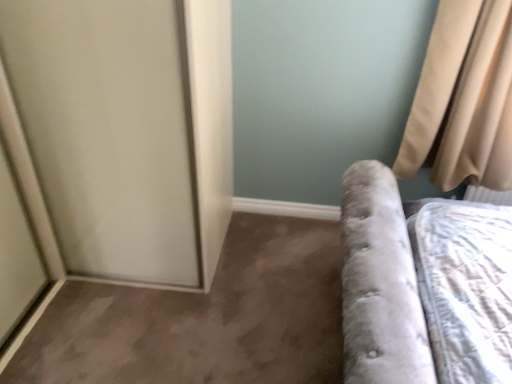
What do you see at coordinates (106, 132) in the screenshot? Image resolution: width=512 pixels, height=384 pixels. I see `white frosted glass screen door at left` at bounding box center [106, 132].

Locate an element on the screen. This screenshot has height=384, width=512. white frosted glass screen door at left is located at coordinates (106, 132).

Measure the distance between white frosted glass screen door at left and camera.

white frosted glass screen door at left is 1.27 meters from camera.

Where is `beige fabric curtain at upper right`? The image size is (512, 384). beige fabric curtain at upper right is located at coordinates (464, 98).

What do you see at coordinates (464, 98) in the screenshot? The width and height of the screenshot is (512, 384). I see `beige fabric curtain at upper right` at bounding box center [464, 98].

Find the location of a particular element. white frosted glass screen door at left is located at coordinates (106, 132).

Considering the relative positions of white frosted glass screen door at left and beige fabric curtain at upper right in the image provided, is white frosted glass screen door at left to the left or to the right of beige fabric curtain at upper right?

From the image, it's evident that white frosted glass screen door at left is to the left of beige fabric curtain at upper right.

Is white frosted glass screen door at left in front of beige fabric curtain at upper right?

Yes, it is in front of beige fabric curtain at upper right.

Is point (191, 236) positioned in front of point (496, 148)?

Yes, point (191, 236) is closer to viewer.

Based on the photo, from the image's perspective, is white frosted glass screen door at left located above beige fabric curtain at upper right?

Actually, white frosted glass screen door at left appears below beige fabric curtain at upper right in the image.

From a real-world perspective, is white frosted glass screen door at left on beige fabric curtain at upper right?

No.

Which of these two, white frosted glass screen door at left or beige fabric curtain at upper right, is thinner?

beige fabric curtain at upper right is thinner.

Who is shorter, white frosted glass screen door at left or beige fabric curtain at upper right?

With less height is beige fabric curtain at upper right.

Is white frosted glass screen door at left smaller than beige fabric curtain at upper right?

No, white frosted glass screen door at left is not smaller than beige fabric curtain at upper right.

Is white frosted glass screen door at left situated inside beige fabric curtain at upper right or outside?

white frosted glass screen door at left is spatially situated outside beige fabric curtain at upper right.

Is white frosted glass screen door at left placed right next to beige fabric curtain at upper right?

No, white frosted glass screen door at left is not making contact with beige fabric curtain at upper right.

Is white frosted glass screen door at left facing away from beige fabric curtain at upper right?

Result: white frosted glass screen door at left is not turned away from beige fabric curtain at upper right.

The image size is (512, 384). Identify the location of curtain behind the white frosted glass screen door at left. (464, 98).

Considering the relative positions of beige fabric curtain at upper right and white frosted glass screen door at left in the image provided, is beige fabric curtain at upper right to the left or to the right of white frosted glass screen door at left?

beige fabric curtain at upper right is to the right of white frosted glass screen door at left.

Considering the relative positions of beige fabric curtain at upper right and white frosted glass screen door at left in the image provided, is beige fabric curtain at upper right behind white frosted glass screen door at left?

Yes, beige fabric curtain at upper right is behind white frosted glass screen door at left.

Is point (449, 169) positioned in front of point (65, 32)?

No.

From the image's perspective, which object appears higher, beige fabric curtain at upper right or white frosted glass screen door at left?

beige fabric curtain at upper right.

From a real-world perspective, which object rests below the other?

In real-world perspective, white frosted glass screen door at left is lower.

Consider the image. Considering the sizes of objects beige fabric curtain at upper right and white frosted glass screen door at left in the image provided, who is wider, beige fabric curtain at upper right or white frosted glass screen door at left?

white frosted glass screen door at left is wider.

Can you confirm if beige fabric curtain at upper right is taller than white frosted glass screen door at left?

No, beige fabric curtain at upper right is not taller than white frosted glass screen door at left.

Does beige fabric curtain at upper right have a larger size compared to white frosted glass screen door at left?

Incorrect, beige fabric curtain at upper right is not larger than white frosted glass screen door at left.

Could white frosted glass screen door at left be considered to be inside beige fabric curtain at upper right?

No, white frosted glass screen door at left is not surrounded by beige fabric curtain at upper right.

Is beige fabric curtain at upper right far from white frosted glass screen door at left?

Yes, beige fabric curtain at upper right and white frosted glass screen door at left are quite far apart.

Is beige fabric curtain at upper right aimed at white frosted glass screen door at left?

No, beige fabric curtain at upper right is not oriented towards white frosted glass screen door at left.

How many degrees apart are the facing directions of beige fabric curtain at upper right and white frosted glass screen door at left?

1.68 degrees separate the facing orientations of beige fabric curtain at upper right and white frosted glass screen door at left.

How far apart are beige fabric curtain at upper right and white frosted glass screen door at left?

The distance of beige fabric curtain at upper right from white frosted glass screen door at left is 1.23 meters.

Where is `curtain above the white frosted glass screen door at left (from a real-world perspective)`? The width and height of the screenshot is (512, 384). curtain above the white frosted glass screen door at left (from a real-world perspective) is located at coordinates (464, 98).

At what (x,y) coordinates should I click in order to perform the action: click on screen door below the beige fabric curtain at upper right (from the image's perspective). Please return your answer as a coordinate pair (x, y). The width and height of the screenshot is (512, 384). Looking at the image, I should click on (106, 132).

Where is `screen door in front of the beige fabric curtain at upper right`? This screenshot has width=512, height=384. screen door in front of the beige fabric curtain at upper right is located at coordinates (106, 132).